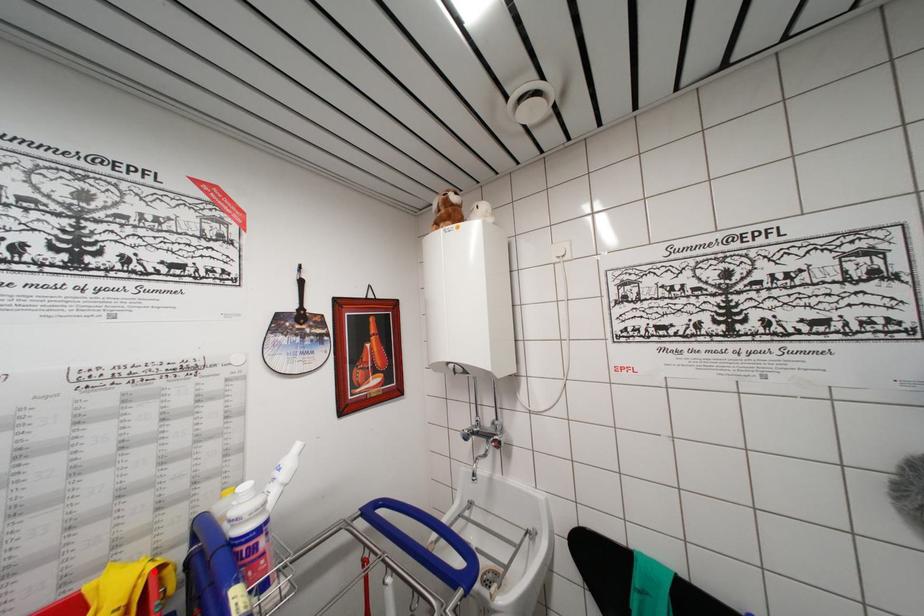
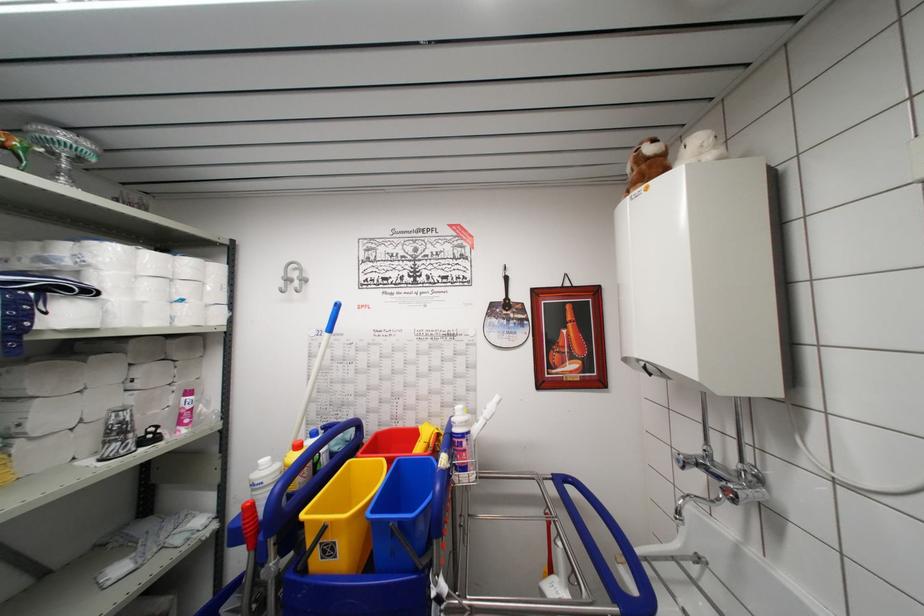
Question: I am providing you with two images of the same scene from different viewpoints. Given a red point in image1, look at the same physical point in image2. Is it:

Choices:
 (A) Closer to the viewpoint
 (B) Farther from the viewpoint

Answer: (B)